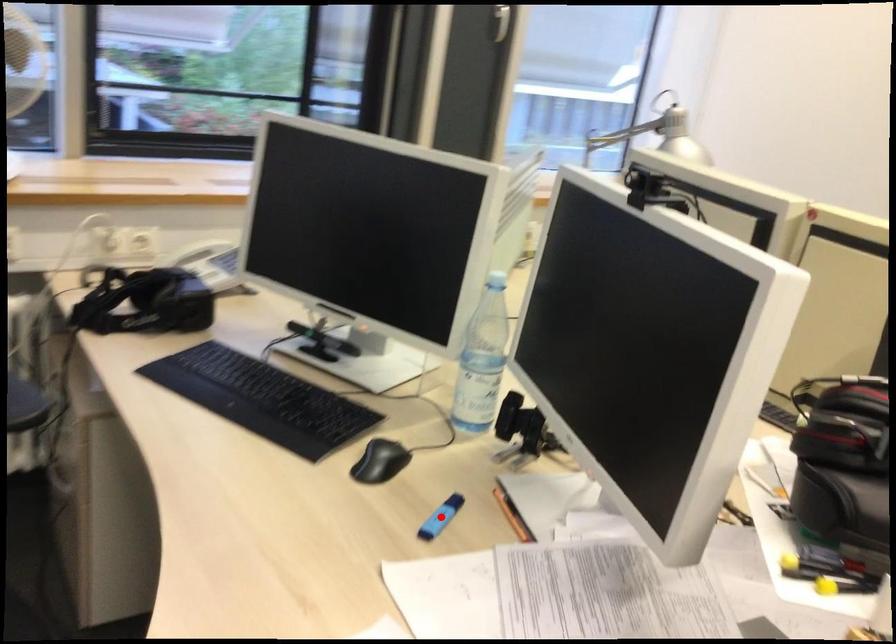
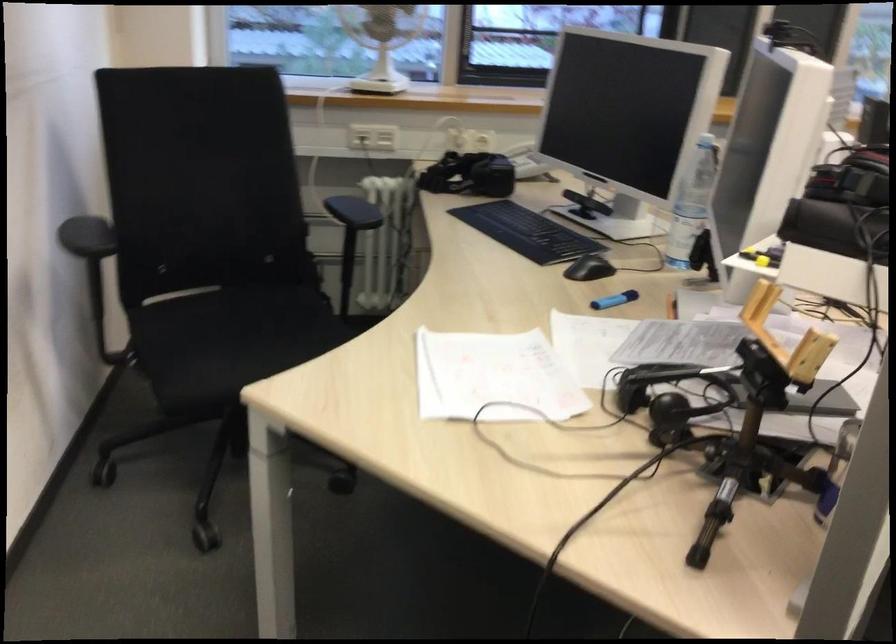
Question: I am providing you with two images of the same scene from different viewpoints. A red point is shown in image1. For the corresponding object point in image2, is it positioned nearer or farther from the camera?

Choices:
 (A) Nearer
 (B) Farther

Answer: (B)